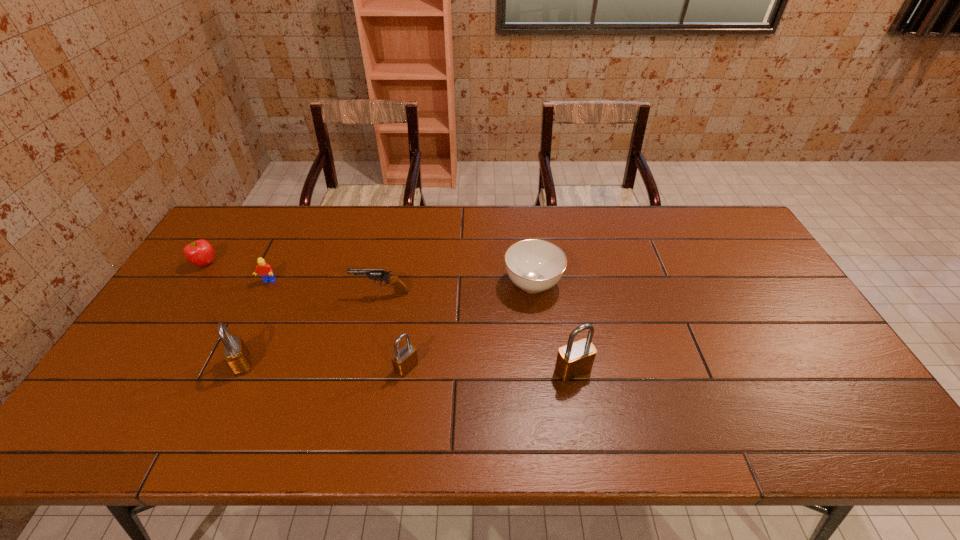
Locate an element on the screen. free space located 0.260m on the right of the shortest padlock is located at coordinates (520, 367).

Find the location of a particular element. The height and width of the screenshot is (540, 960). free space located on the back of the rightmost padlock is located at coordinates (563, 312).

The width and height of the screenshot is (960, 540). I want to click on vacant space located on the back of the leftmost object, so click(x=236, y=217).

Locate an element on the screen. vacant space located on the front-facing side of the Lego is located at coordinates click(x=252, y=315).

Image resolution: width=960 pixels, height=540 pixels. What are the coordinates of `vacant space located 0.130m on the back of the chinaware` in the screenshot? It's located at pos(527,238).

Where is `vacant space positioned along the barrel of the gun`? This screenshot has width=960, height=540. vacant space positioned along the barrel of the gun is located at coordinates (269, 294).

What are the coordinates of `free location located along the barrel of the gun` in the screenshot? It's located at (316, 294).

The height and width of the screenshot is (540, 960). Identify the location of vacant area located along the barrel of the gun. (228, 294).

The width and height of the screenshot is (960, 540). Identify the location of object that is positioned at the left edge. (200, 253).

Locate an element on the screen. free region at the far edge of the desktop is located at coordinates (449, 210).